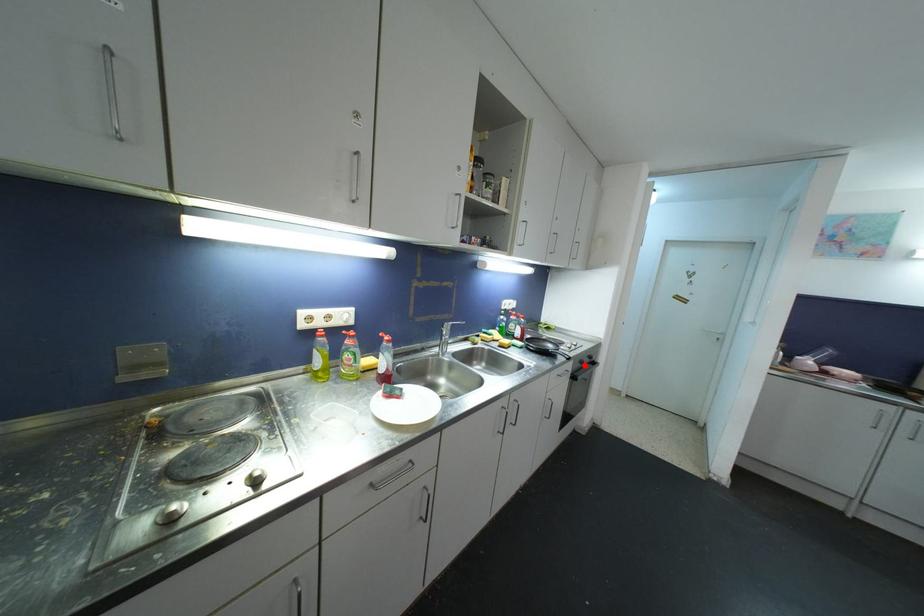
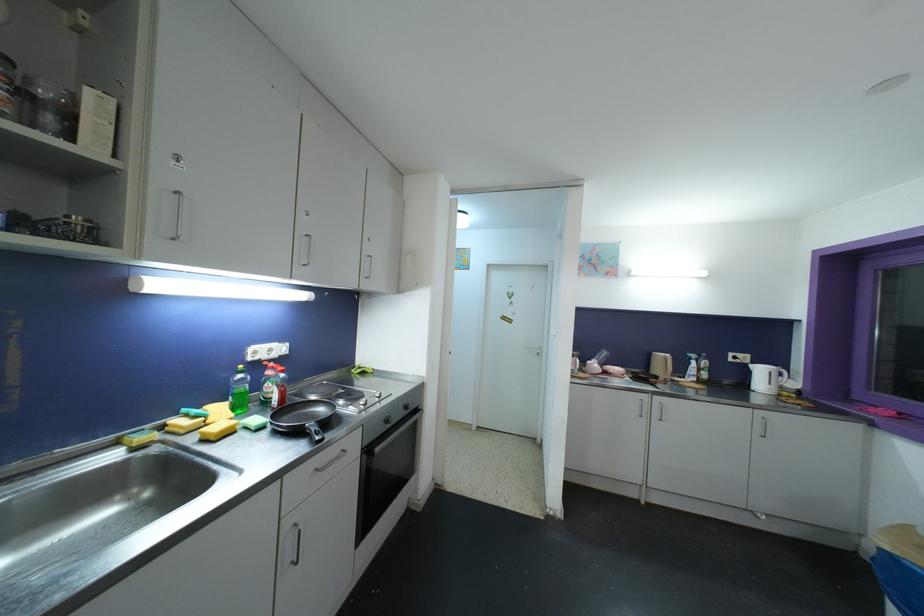
Find the pixel in the second image that matches the highlighted location in the first image.

(390, 424)